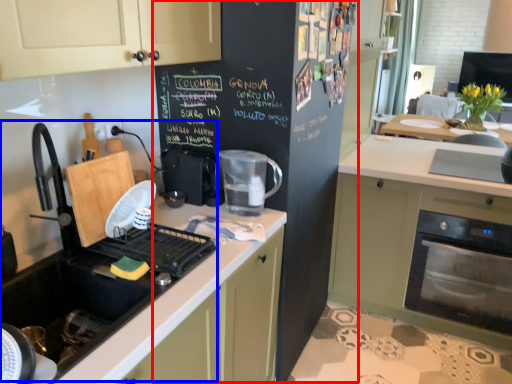
Question: Which object is closer to the camera taking this photo, bulletin board (highlighted by a red box) or sink (highlighted by a blue box)?

Choices:
 (A) bulletin board
 (B) sink

Answer: (B)